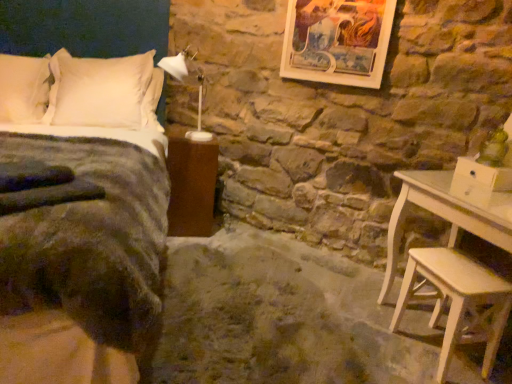
In order to click on unoccupied region to the right of brown wood nightstand at lower left in this screenshot , I will do `click(226, 237)`.